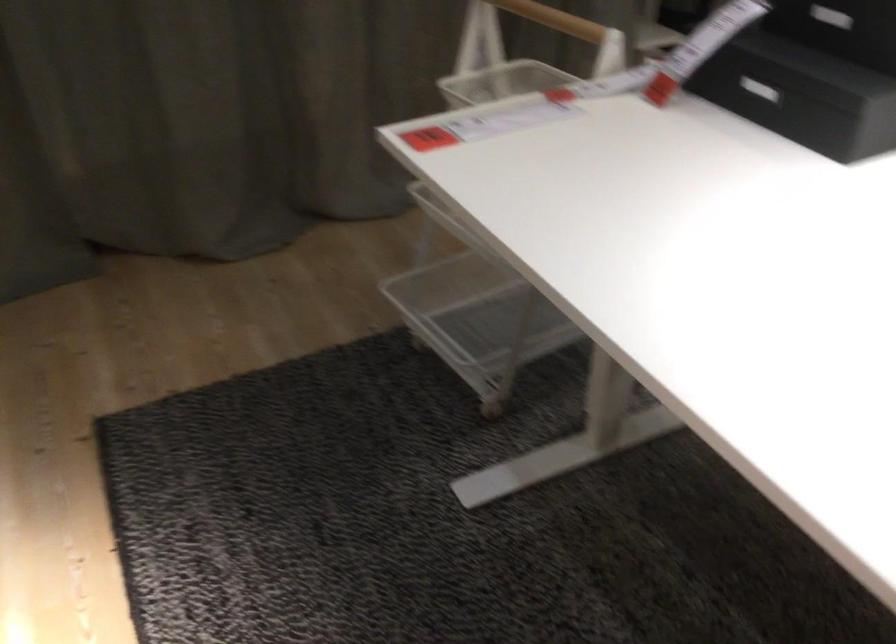
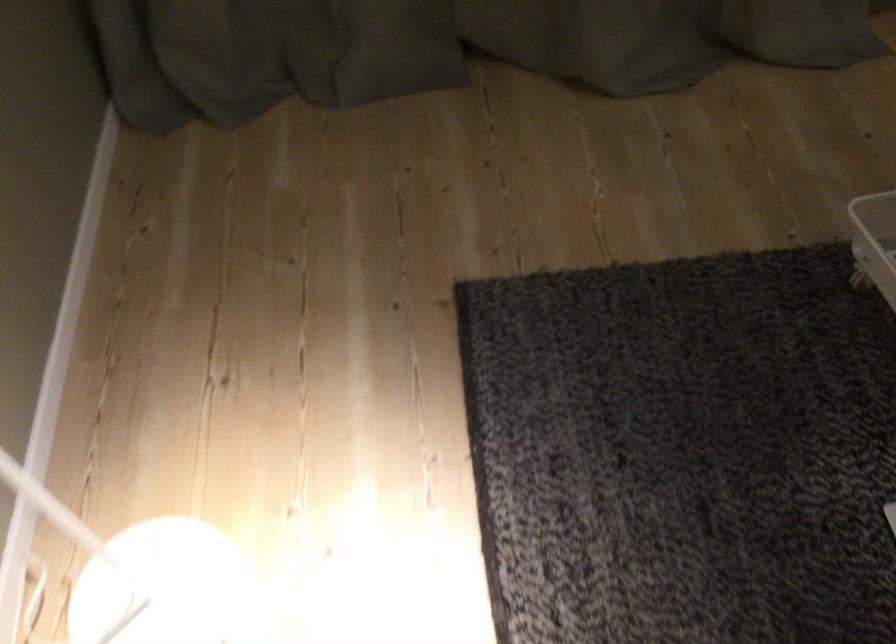
In a continuous first-person perspective shot, in which direction is the camera moving?

The movement direction of the cameraman is left, forward.